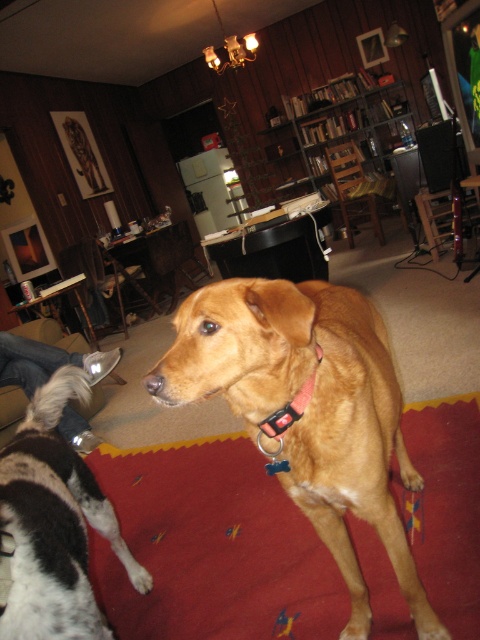
You are standing in the living room and want to take a photo of the two points marked in the scene. Which point, point (360,413) or point (80,540), is closer to you?

Point (360,413) is closer to the camera than point (80,540), so it is closer to you.

You are a pet sitter entering the living room. You see a golden fur dog at center and a white fur at lower left. Which one is wider?

The golden fur dog at center is less wide than the white fur at lower left, so the white fur at lower left is wider.